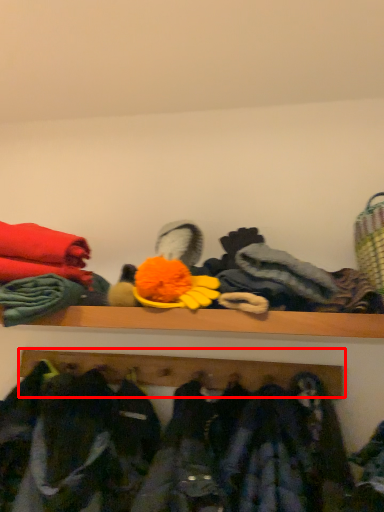
Question: Considering the relative positions of shelf (annotated by the red box) and clothing in the image provided, where is shelf (annotated by the red box) located with respect to the staircase?

Choices:
 (A) right
 (B) left

Answer: (B)